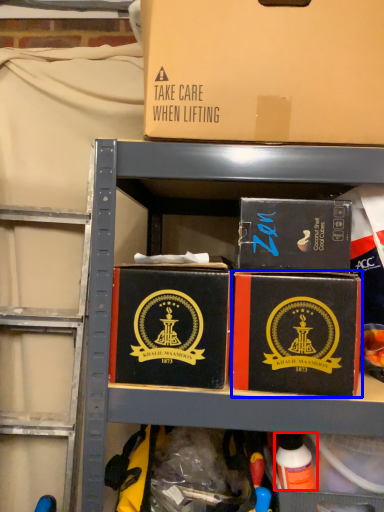
Question: Which object appears farthest to the camera in this image, toy (highlighted by a red box) or box (highlighted by a blue box)?

Choices:
 (A) toy
 (B) box

Answer: (A)